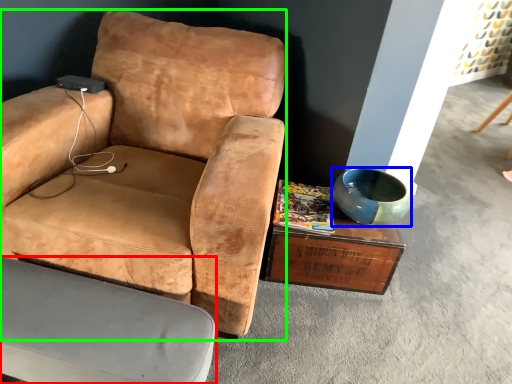
Question: Which is nearer to the chair (highlighted by a red box)? bowl (highlighted by a blue box) or chair (highlighted by a green box).

Choices:
 (A) bowl
 (B) chair

Answer: (B)